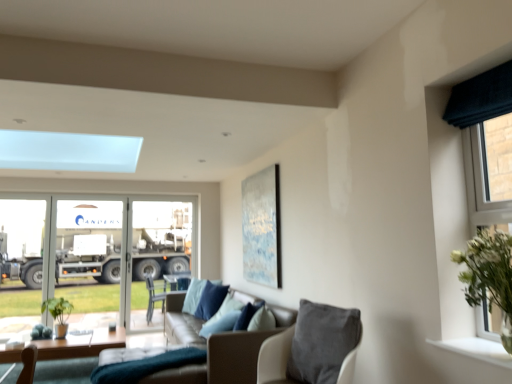
Question: Is leather couch at center smaller than dark blue fabric curtain at right?

Choices:
 (A) no
 (B) yes

Answer: (A)

Question: Does leather couch at center appear on the right side of dark blue fabric curtain at right?

Choices:
 (A) no
 (B) yes

Answer: (A)

Question: From a real-world perspective, is leather couch at center physically above dark blue fabric curtain at right?

Choices:
 (A) no
 (B) yes

Answer: (A)

Question: Does leather couch at center have a greater width compared to dark blue fabric curtain at right?

Choices:
 (A) yes
 (B) no

Answer: (A)

Question: Is leather couch at center next to dark blue fabric curtain at right and touching it?

Choices:
 (A) no
 (B) yes

Answer: (A)

Question: In terms of size, does metallic silver trailer truck at left appear bigger or smaller than dark blue fabric curtain at right?

Choices:
 (A) small
 (B) big

Answer: (B)

Question: Is metallic silver trailer truck at left inside the boundaries of dark blue fabric curtain at right, or outside?

Choices:
 (A) outside
 (B) inside

Answer: (A)

Question: From the image's perspective, relative to dark blue fabric curtain at right, is metallic silver trailer truck at left above or below?

Choices:
 (A) below
 (B) above

Answer: (A)

Question: In terms of height, does metallic silver trailer truck at left look taller or shorter compared to dark blue fabric curtain at right?

Choices:
 (A) tall
 (B) short

Answer: (A)

Question: Is leather couch at center situated inside leather couch at center or outside?

Choices:
 (A) outside
 (B) inside

Answer: (B)

Question: From the image's perspective, is leather couch at center located above or below leather couch at center?

Choices:
 (A) below
 (B) above

Answer: (A)

Question: Based on their positions, is leather couch at center located to the left or right of leather couch at center?

Choices:
 (A) right
 (B) left

Answer: (A)

Question: Relative to leather couch at center, is leather couch at center in front or behind?

Choices:
 (A) front
 (B) behind

Answer: (B)

Question: Looking at their shapes, would you say suede-like beige chair at lower center is wider or thinner than metallic silver trailer truck at left?

Choices:
 (A) wide
 (B) thin

Answer: (A)

Question: From a real-world perspective, is suede-like beige chair at lower center positioned above or below metallic silver trailer truck at left?

Choices:
 (A) above
 (B) below

Answer: (B)